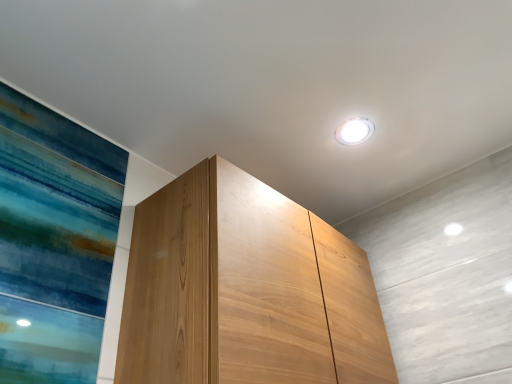
This screenshot has height=384, width=512. What do you see at coordinates (245, 290) in the screenshot? I see `light brown wood cupboard at center` at bounding box center [245, 290].

Where is `light brown wood cupboard at center`? light brown wood cupboard at center is located at coordinates (245, 290).

The height and width of the screenshot is (384, 512). Identify the location of light brown wood cupboard at center. (245, 290).